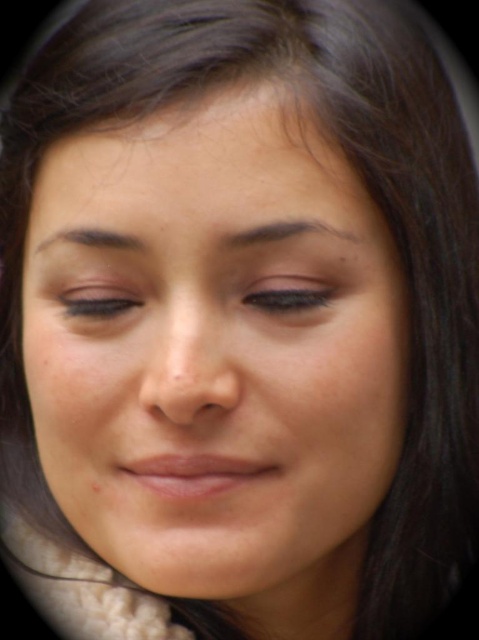
You are an artist trying to replicate this portrait. You want to place a highlight on the matte black eye at upper center. According to the image, where should you place the highlight relative to the eye?

The highlight should be placed at the point where light naturally reflects on the eye. Since the eye is located at coordinates (289,296), the highlight would typically be positioned near the upper right quadrant of the eye to mimic natural lighting effects.

You are an artist trying to sketch this person. Where exactly should you place the smooth skin face at center in terms of coordinates?

The smooth skin face at center should be placed at coordinates point (216,348).

You are an artist sketching a portrait and need to ensure anatomical accuracy. Based on the image, is the matte black eye at upper center located above or below the matte black eye at center?

The matte black eye at upper center is positioned over matte black eye at center, so it is located above the other eye.